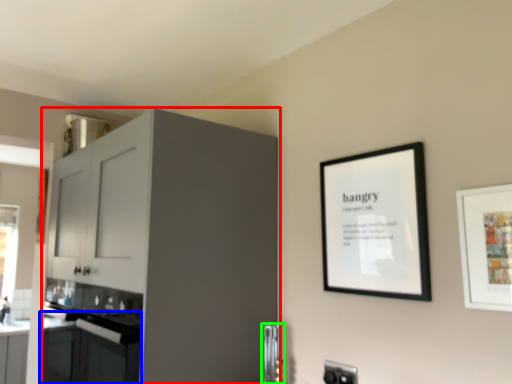
Question: Considering the real-world distances, which object is farthest from cabinetry (highlighted by a red box)? oven (highlighted by a blue box) or appliance (highlighted by a green box)?

Choices:
 (A) oven
 (B) appliance

Answer: (B)